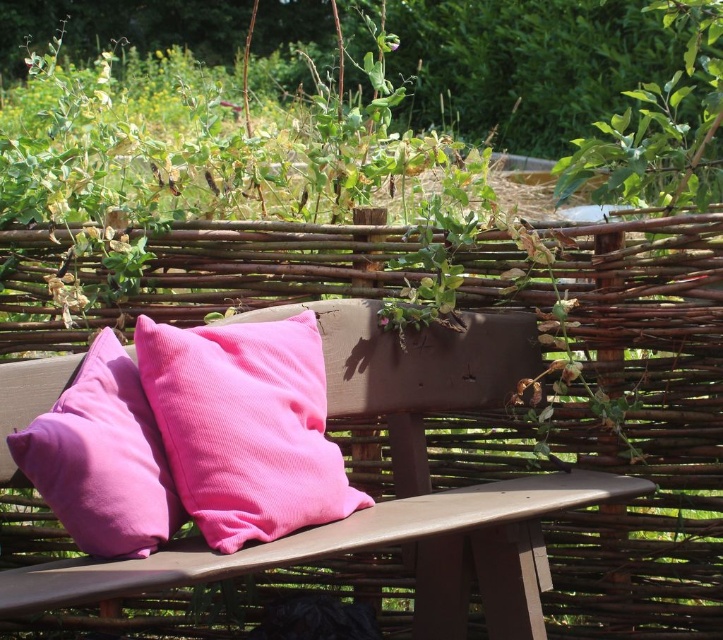
In the scene shown: You are sitting on the matte wood park bench at center and want to place your phone on the pink corduroy pillow at left. Can you reach it without moving from the bench?

The matte wood park bench at center is positioned under the pink corduroy pillow at left, so yes, you can reach the pink corduroy pillow at left from the bench without moving.

You are planning to place a rectangular box that is 1.2 meters long on the matte wood park bench at center. The pink corduroy pillow at center is already occupying part of the bench. Can the box fit on the remaining space of the bench?

The matte wood park bench at center is wider than the pink corduroy pillow at center. Since the bench is wider, there might be enough space left after accounting for the pillow to accommodate the 1.2 meter box. However, the exact fit depends on the total width of the bench and how much space the pillow occupies.